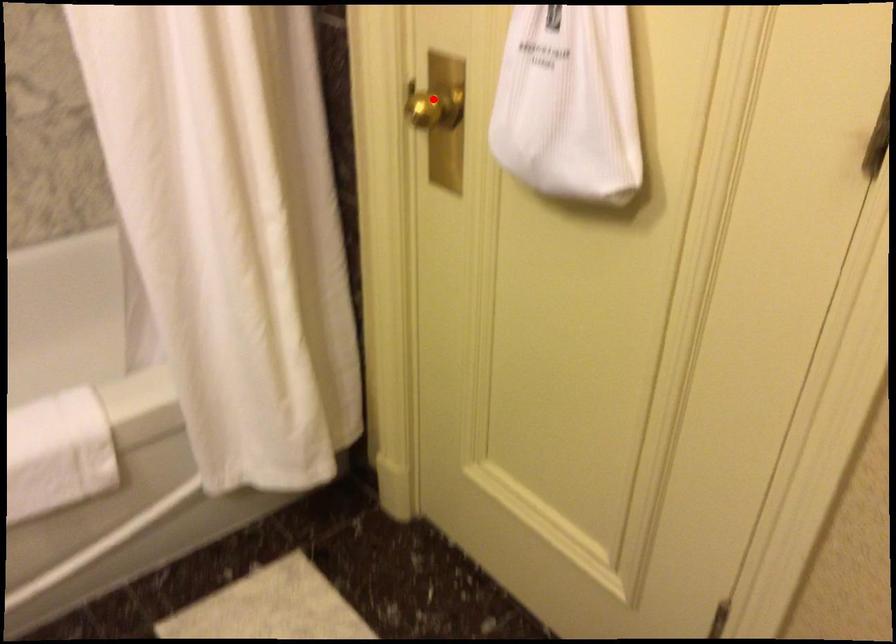
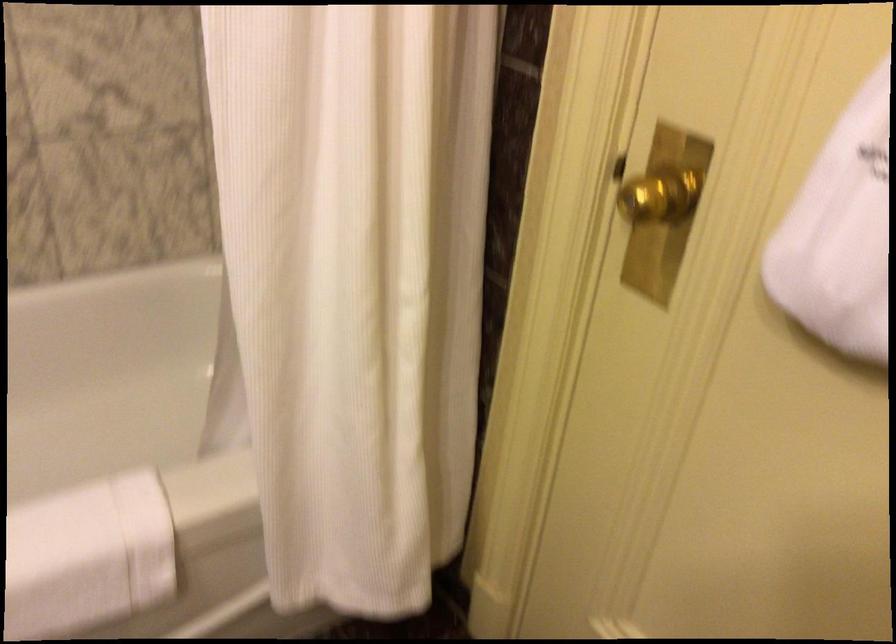
Locate, in the second image, the point that corresponds to the highlighted location in the first image.

(657, 194)